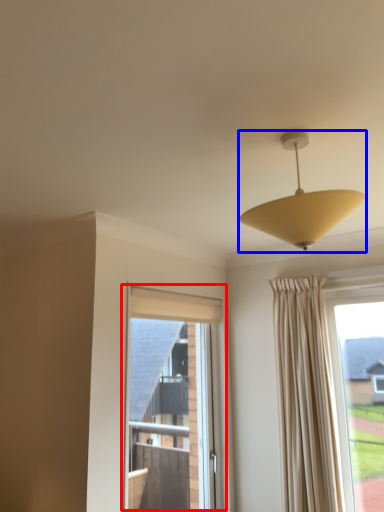
Question: Which object is further to the camera taking this photo, window (highlighted by a red box) or lamp (highlighted by a blue box)?

Choices:
 (A) window
 (B) lamp

Answer: (A)